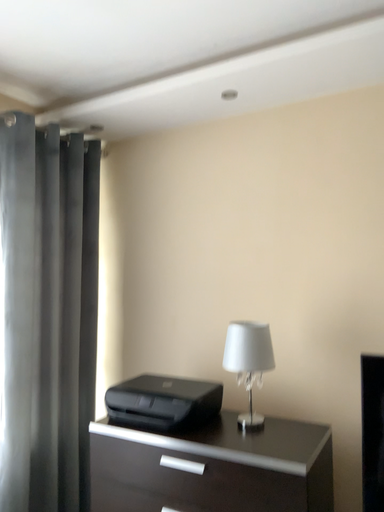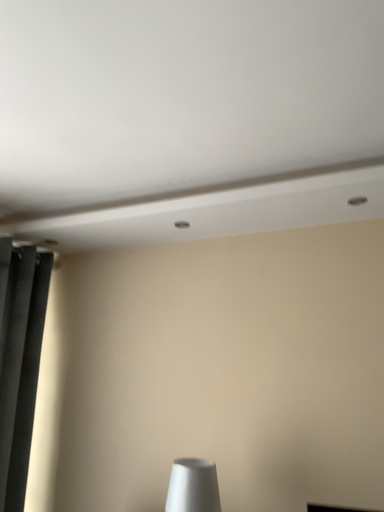
Question: Which way did the camera rotate in the video?

Choices:
 (A) rotated right
 (B) rotated left

Answer: (A)